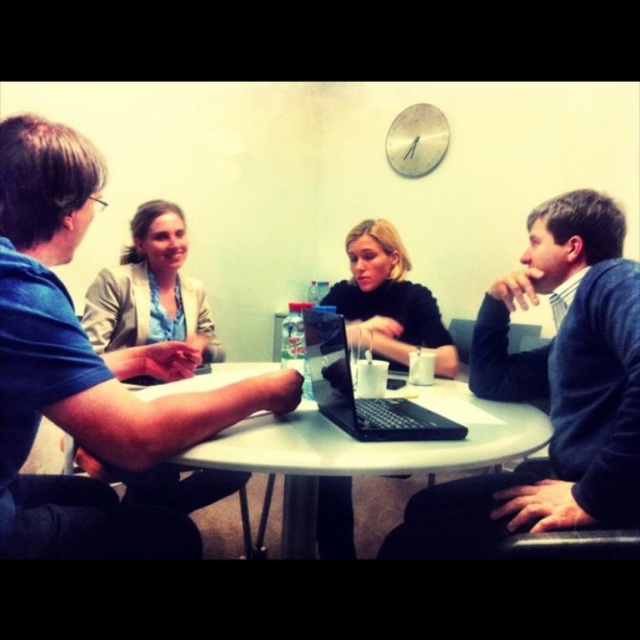
Does blue matte shirt at upper left have a greater width compared to black matte laptop at center?

Indeed, blue matte shirt at upper left has a greater width compared to black matte laptop at center.

At what (x,y) coordinates should I click in order to perform the action: click on blue matte shirt at upper left. Please return your answer as a coordinate pair (x, y). Image resolution: width=640 pixels, height=640 pixels. Looking at the image, I should click on (92, 380).

Does blue matte shirt at upper left have a lesser width compared to dark blue sweater at right?

No, blue matte shirt at upper left is not thinner than dark blue sweater at right.

Who is positioned more to the right, blue matte shirt at upper left or dark blue sweater at right?

dark blue sweater at right is more to the right.

This screenshot has height=640, width=640. I want to click on blue matte shirt at upper left, so click(x=92, y=380).

Is the position of dark blue sweater at right more distant than that of white plastic table at center?

Yes, dark blue sweater at right is behind white plastic table at center.

Can you confirm if dark blue sweater at right is smaller than white plastic table at center?

Actually, dark blue sweater at right might be larger than white plastic table at center.

I want to click on dark blue sweater at right, so click(x=550, y=392).

The width and height of the screenshot is (640, 640). What are the coordinates of `dark blue sweater at right` in the screenshot? It's located at (550, 392).